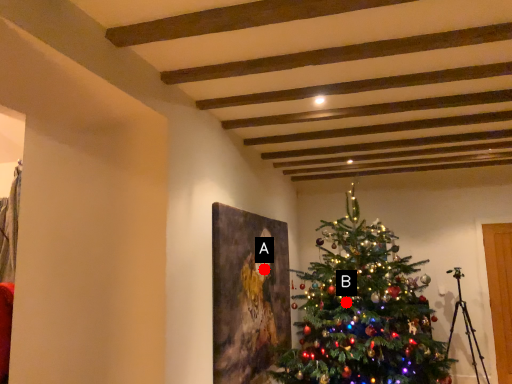
Question: Two points are circled on the image, labeled by A and B beside each circle. Among these points, which one is nearest to the camera?

Choices:
 (A) A is closer
 (B) B is closer

Answer: (B)